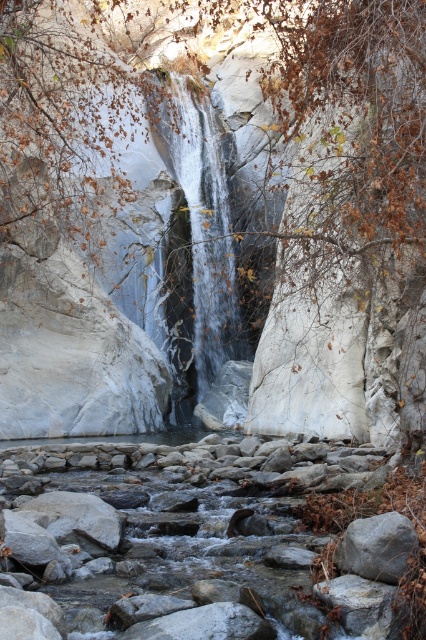
Question: Is smooth gray rock at center closer to camera compared to gray rough rock at center?

Choices:
 (A) no
 (B) yes

Answer: (A)

Question: Does smooth gray rock at center have a lesser width compared to gray rough rock at center?

Choices:
 (A) yes
 (B) no

Answer: (B)

Question: From the image, what is the correct spatial relationship of smooth gray rock at center in relation to gray rough rock at center?

Choices:
 (A) left
 (B) right

Answer: (A)

Question: Which point is closer to the camera?

Choices:
 (A) (385, 579)
 (B) (207, 358)

Answer: (A)

Question: Which object appears closest to the camera in this image?

Choices:
 (A) smooth gray rock at center
 (B) gray rough rock at center

Answer: (B)